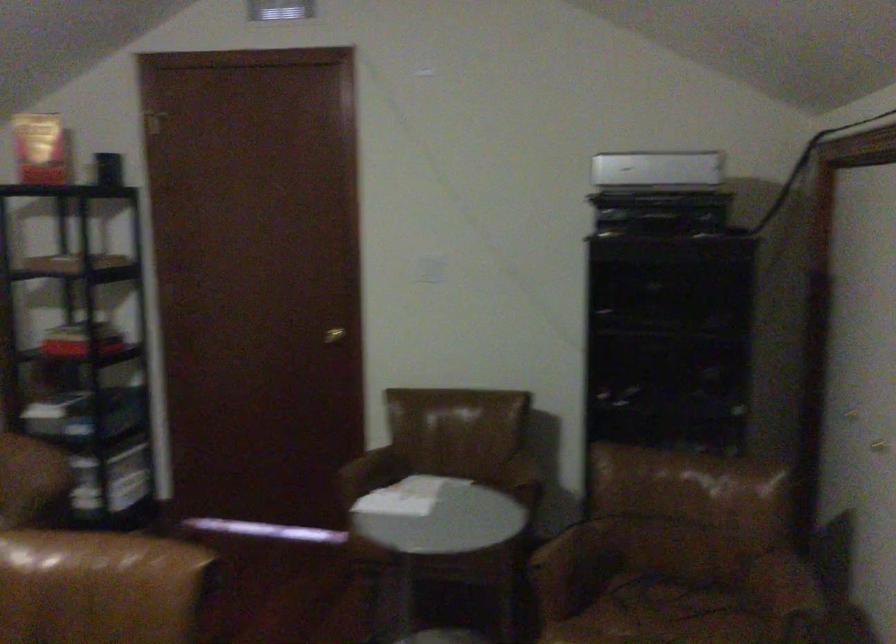
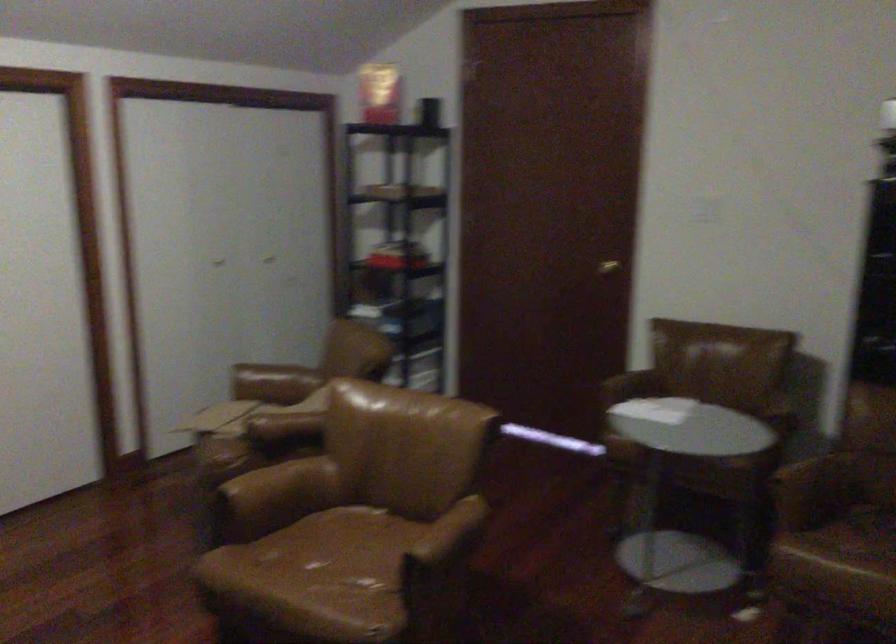
The point at (325, 342) is marked in the first image. Where is the corresponding point in the second image?

(607, 267)